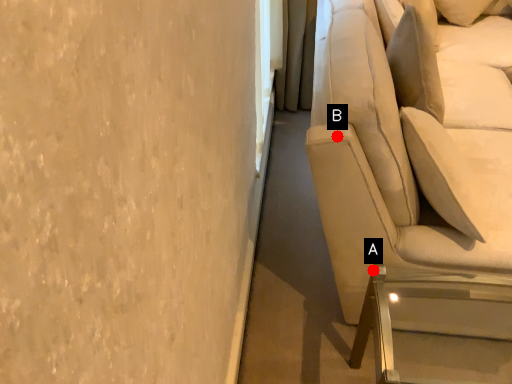
Question: Two points are circled on the image, labeled by A and B beside each circle. Among these points, which one is farthest from the camera?

Choices:
 (A) A is further
 (B) B is further

Answer: (A)